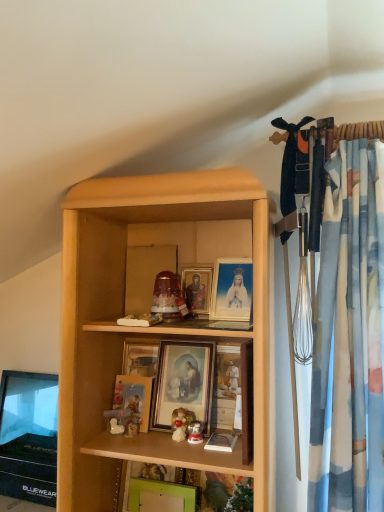
Question: Does point (119, 374) appear closer or farther from the camera than point (205, 419)?

Choices:
 (A) farther
 (B) closer

Answer: (A)

Question: Is matte gold picture frame at center, acting as the third picture frame starting from the top, to the left or to the right of matte gold picture frame at center, the 3th picture frame when ordered from bottom to top, in the image?

Choices:
 (A) left
 (B) right

Answer: (A)

Question: Which object is positioned farthest from the matte gold picture frame at center, the 3th picture frame when ordered from bottom to top?

Choices:
 (A) green matte picture frame at lower center, which appears as the first picture frame when ordered from the bottom
 (B) wooden picture frame at center, acting as the 4th picture frame starting from the bottom
 (C) matte gold picture frame at center, acting as the third picture frame starting from the top

Answer: (A)

Question: Considering the real-world distances, which object is farthest from the matte gold picture frame at center, the 3th picture frame when ordered from bottom to top?

Choices:
 (A) green matte picture frame at lower center, which appears as the first picture frame when ordered from the bottom
 (B) wooden picture frame at center, placed as the first picture frame when sorted from top to bottom
 (C) matte gold picture frame at center, positioned as the second picture frame in bottom-to-top order

Answer: (A)